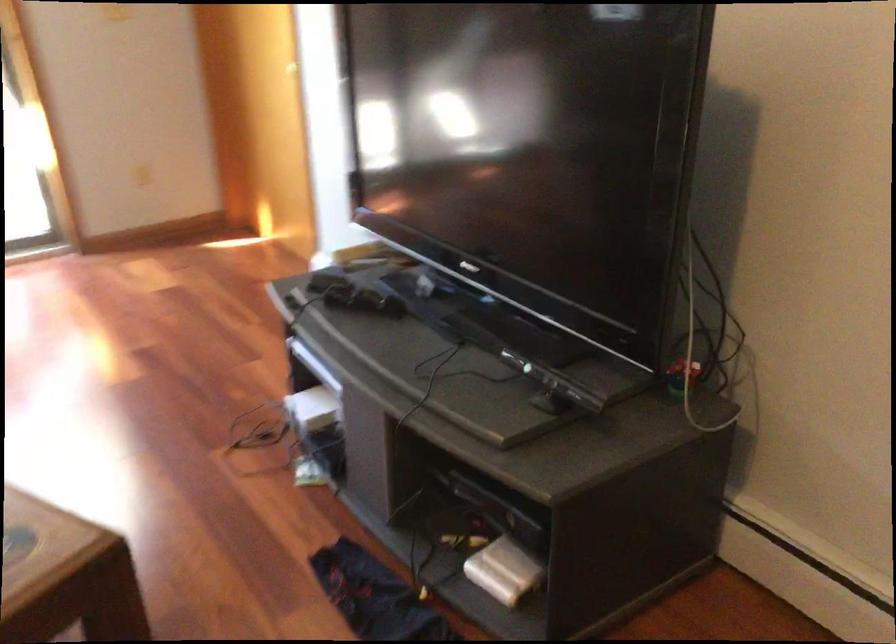
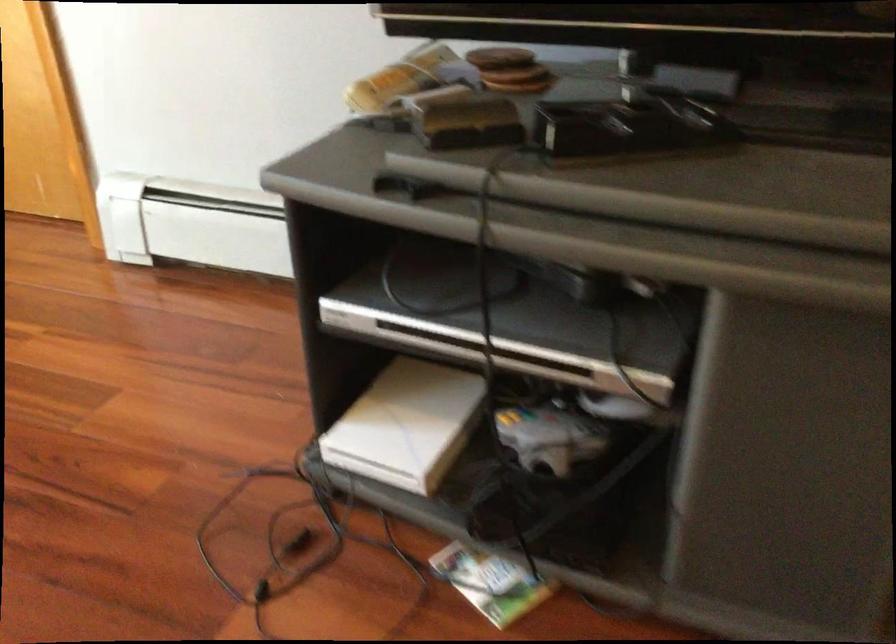
Locate, in the second image, the point that corresponds to (313,399) in the first image.

(407, 424)